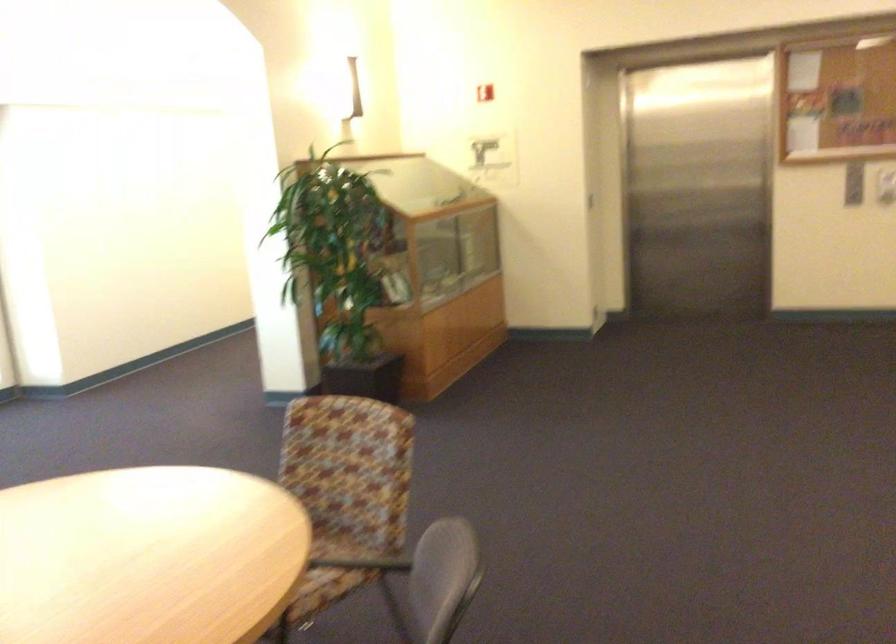
Find where to sit the grey chair sitting surface. Please return your answer as a coordinate pair (x, y).

(435, 583)